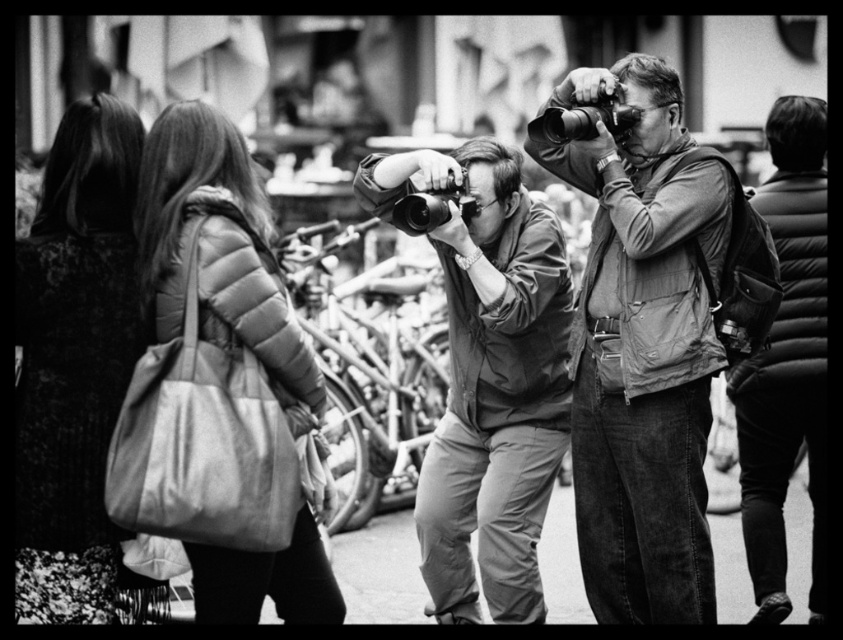
Question: Can you confirm if leather handbag at left is positioned below matte puffer jacket at left?

Choices:
 (A) no
 (B) yes

Answer: (A)

Question: Estimate the real-world distances between objects in this image. Which object is closer to the matte puffer jacket at left?

Choices:
 (A) leather jacket at right
 (B) matte black camera at center

Answer: (B)

Question: Is leather handbag at left bigger than matte puffer jacket at left?

Choices:
 (A) yes
 (B) no

Answer: (B)

Question: Which object appears farthest from the camera in this image?

Choices:
 (A) matte puffer jacket at left
 (B) leather handbag at left
 (C) matte black camera at center
 (D) matte gray vest at center

Answer: (C)

Question: Does leather handbag at left appear under leather jacket at right?

Choices:
 (A) yes
 (B) no

Answer: (B)

Question: Which point is closer to the camera?

Choices:
 (A) (49, 413)
 (B) (771, 616)
 (C) (631, 269)

Answer: (A)